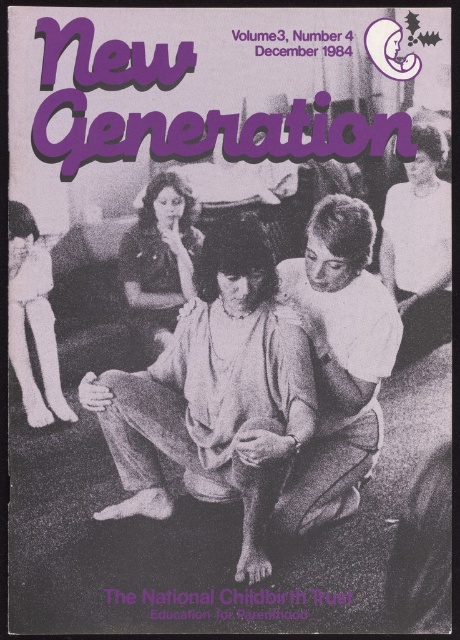
Question: Does matte black shirt at center appear on the left side of matte white doll at left?

Choices:
 (A) yes
 (B) no

Answer: (B)

Question: Among these points, which one is farthest from the camera?

Choices:
 (A) (396, 216)
 (B) (161, 406)

Answer: (A)

Question: Which object appears closest to the camera in this image?

Choices:
 (A) matte white doll at left
 (B) white smooth shirt at right

Answer: (A)

Question: Does matte black shirt at center have a larger size compared to matte white doll at left?

Choices:
 (A) yes
 (B) no

Answer: (A)

Question: Among these points, which one is farthest from the camera?

Choices:
 (A) (421, 296)
 (B) (247, 332)

Answer: (A)

Question: Can you confirm if white cotton shirt at center is smaller than matte black shirt at center?

Choices:
 (A) no
 (B) yes

Answer: (A)